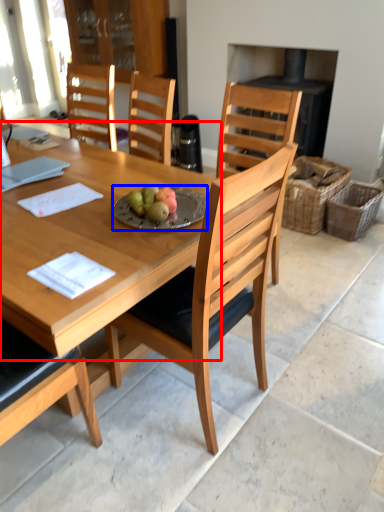
Question: Which point is further to the camera, round table (highlighted by a red box) or plate (highlighted by a blue box)?

Choices:
 (A) round table
 (B) plate

Answer: (B)